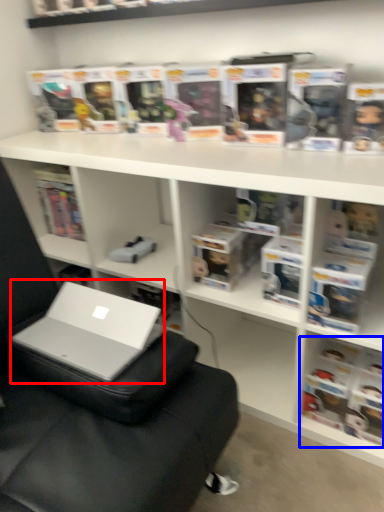
Question: Which of the following is the closest to the observer, laptop (highlighted by a red box) or book (highlighted by a blue box)?

Choices:
 (A) laptop
 (B) book

Answer: (A)